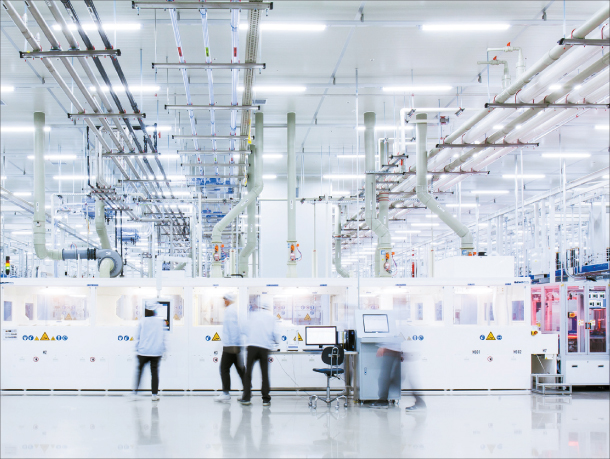
You are a GUI agent. You are given a task and a screenshot of the screen. Output one action in this format:
    pyautogui.click(x=<x>, y=<y>)
    Task: Click on the ceiling
    The height and width of the screenshot is (459, 610).
    Given the screenshot: What is the action you would take?
    coord(362,54)